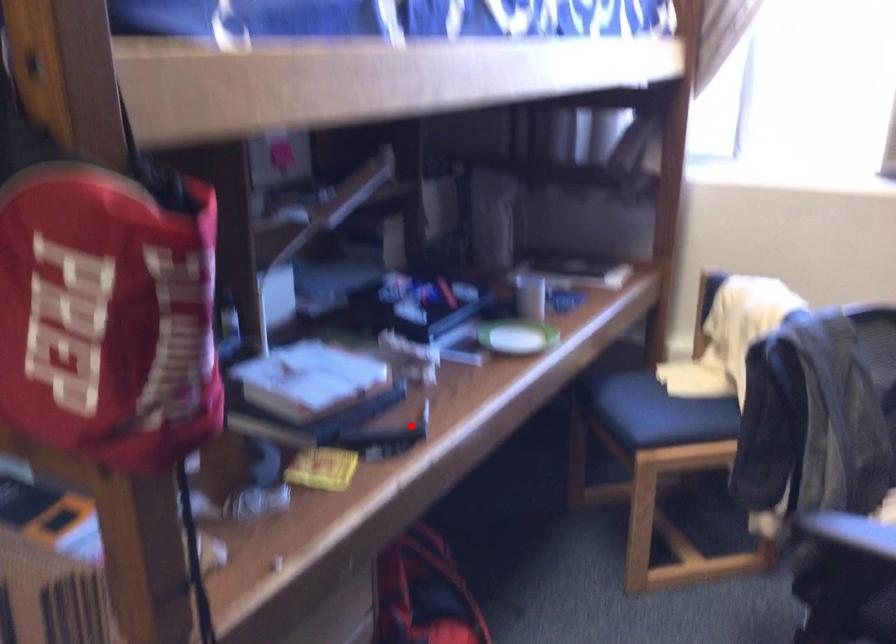
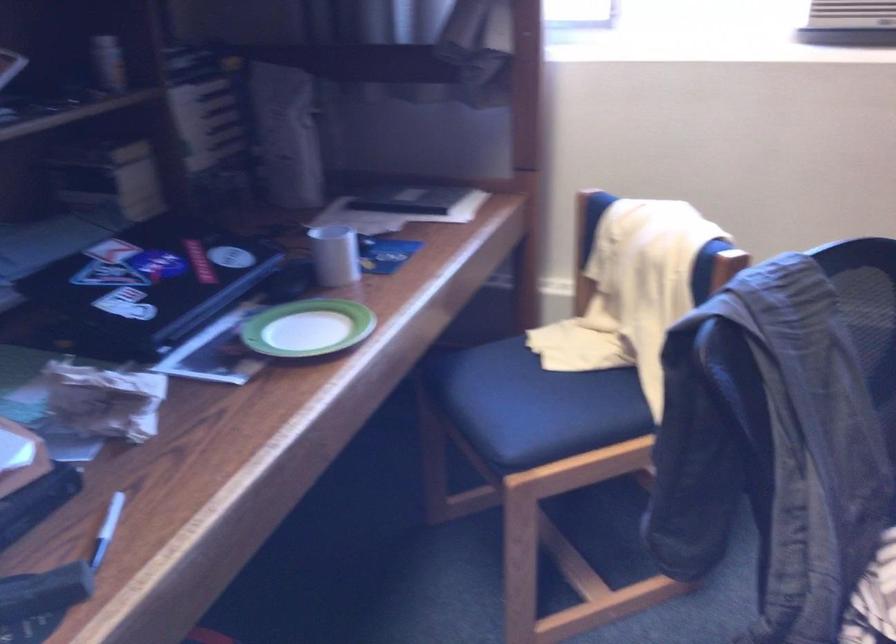
Where in the second image is the point corresponding to the highlighted location from the first image?

(107, 529)